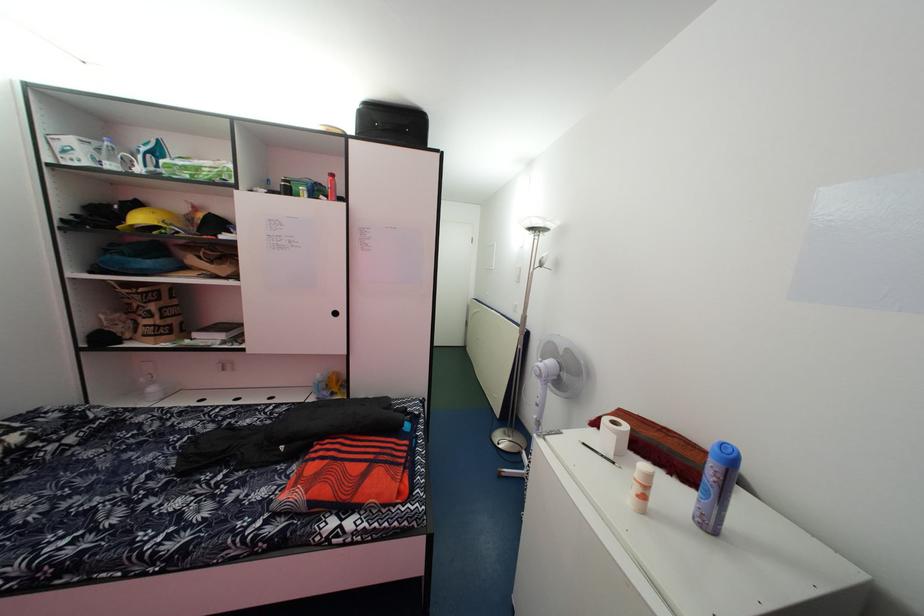
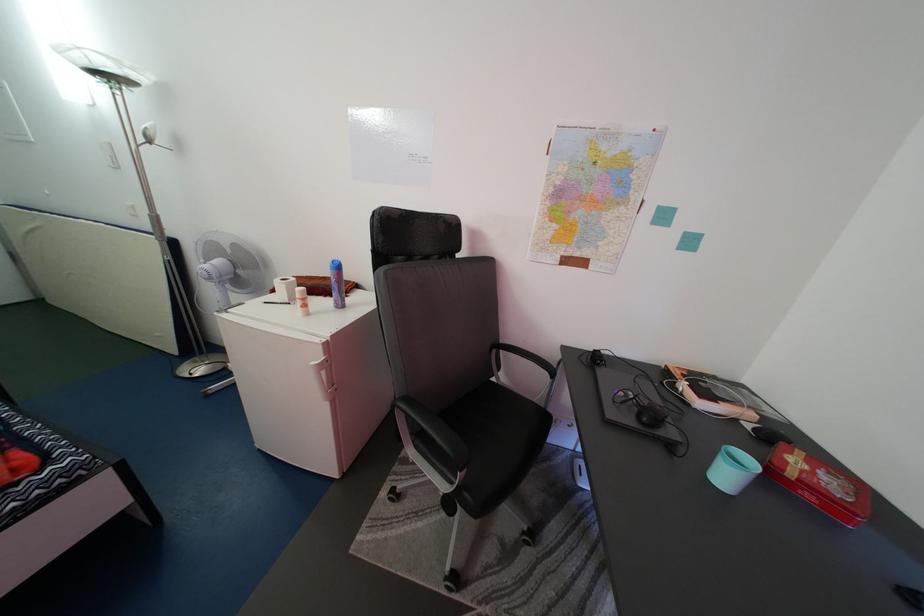
Where in the second image is the point corresponding to (678,482) from the first image?

(334, 304)